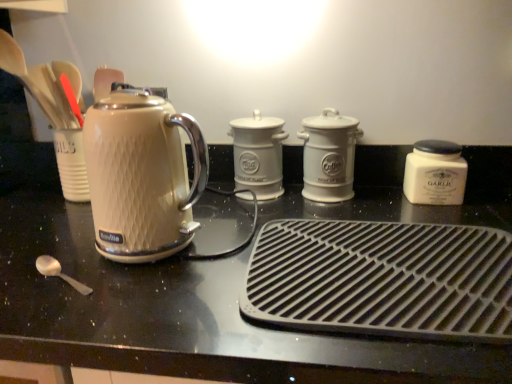
Question: From a real-world perspective, is matte white kettle at left physically located above or below black rubber mat at center, placed as the fourth kitchen appliance when sorted from back to front?

Choices:
 (A) below
 (B) above

Answer: (A)

Question: From their relative heights in the image, would you say matte white kettle at left is taller or shorter than black rubber mat at center, which is the first kitchen appliance from front to back?

Choices:
 (A) tall
 (B) short

Answer: (A)

Question: Estimate the real-world distances between objects in this image. Which object is farther from the matte cream kettle at left?

Choices:
 (A) white ceramic coffee canister at center, the 3th kitchen appliance viewed from the front
 (B) black rubber mat at center, which is the first kitchen appliance from front to back
 (C) white ceramic jar at right, which is counted as the third kitchen appliance, starting from the back
 (D) matte white kettle at left
 (E) white ceramic canister at center, arranged as the fourth kitchen appliance when viewed from the front

Answer: (C)

Question: Which of these objects is positioned farthest from the matte cream kettle at left?

Choices:
 (A) white ceramic canister at center, arranged as the fourth kitchen appliance when viewed from the front
 (B) white ceramic coffee canister at center, the 3th kitchen appliance viewed from the front
 (C) black rubber mat at center, which is the first kitchen appliance from front to back
 (D) white ceramic jar at right, which is counted as the third kitchen appliance, starting from the back
 (E) matte white kettle at left

Answer: (D)